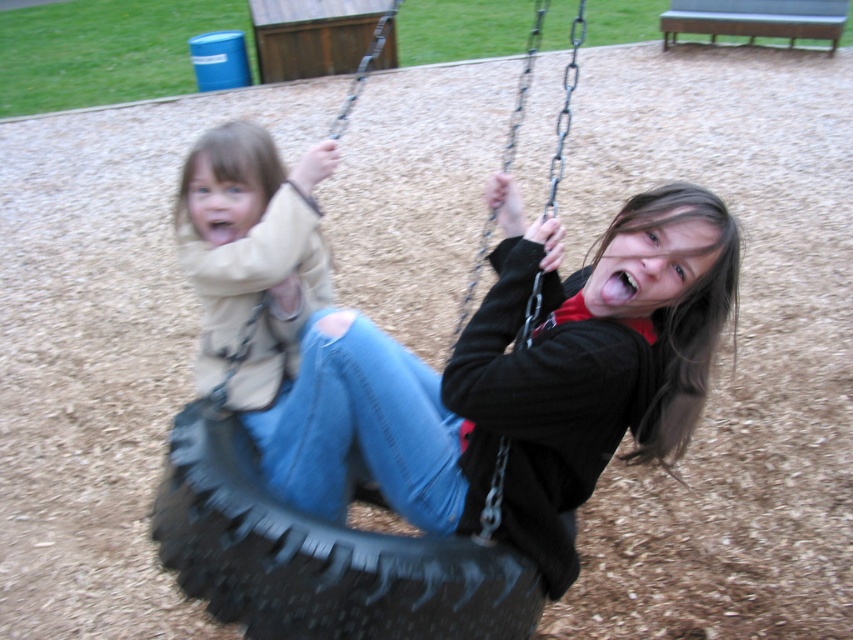
Question: Among these points, which one is farthest from the camera?

Choices:
 (A) (328, 289)
 (B) (357, 593)
 (C) (582, 380)

Answer: (A)

Question: Can you confirm if black rubber tire at center is positioned to the left of metallic chain swing at center?

Choices:
 (A) no
 (B) yes

Answer: (B)

Question: Among these points, which one is nearest to the camera?

Choices:
 (A) (233, 278)
 (B) (488, 545)

Answer: (B)

Question: Which of the following is the farthest from the observer?

Choices:
 (A) (207, 413)
 (B) (415, 397)
 (C) (263, 285)

Answer: (C)

Question: Is matte black tire swing at center to the left of black rubber tire at center from the viewer's perspective?

Choices:
 (A) no
 (B) yes

Answer: (A)

Question: Does ripped denim jeans at left appear over metallic chain swing at center?

Choices:
 (A) yes
 (B) no

Answer: (B)